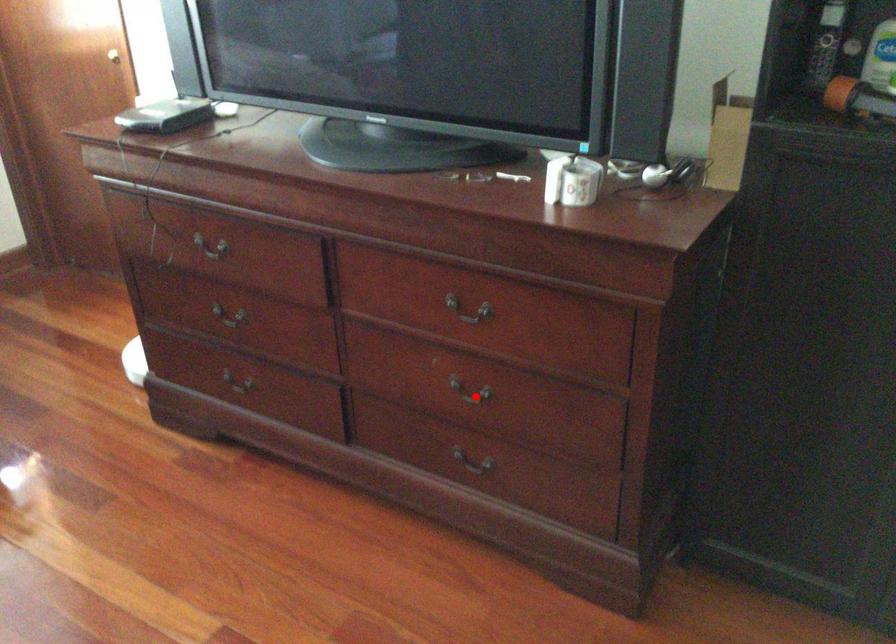
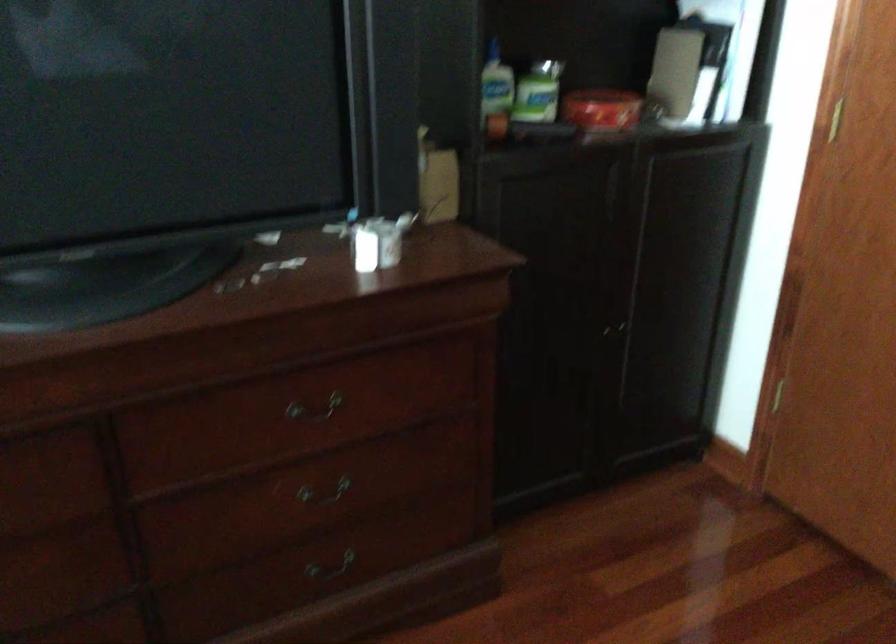
Find the pixel in the second image that matches the highlighted location in the first image.

(323, 491)